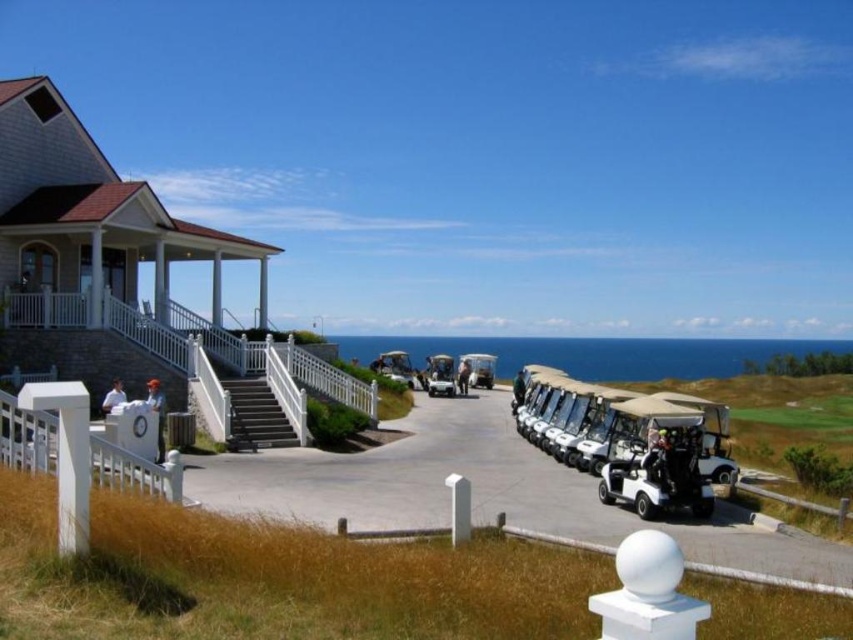
Does white painted wood porch at left have a lesser height compared to smooth concrete stairs at center?

No.

Can you confirm if white painted wood porch at left is positioned to the left of smooth concrete stairs at center?

Yes, white painted wood porch at left is to the left of smooth concrete stairs at center.

This screenshot has height=640, width=853. I want to click on white painted wood porch at left, so click(201, 353).

Who is lower down, white painted wood porch at left or blue water at center?

blue water at center is lower down.

Is the position of white painted wood porch at left less distant than that of blue water at center?

That is True.

The width and height of the screenshot is (853, 640). Identify the location of white painted wood porch at left. (201, 353).

What are the coordinates of `white painted wood porch at left` in the screenshot? It's located at (201, 353).

Which is above, blue water at center or smooth concrete stairs at center?

smooth concrete stairs at center

Who is more distant from viewer, (x=570, y=355) or (x=254, y=394)?

The point (x=570, y=355) is behind.

This screenshot has height=640, width=853. Describe the element at coordinates (596, 353) in the screenshot. I see `blue water at center` at that location.

Image resolution: width=853 pixels, height=640 pixels. What are the coordinates of `blue water at center` in the screenshot? It's located at (596, 353).